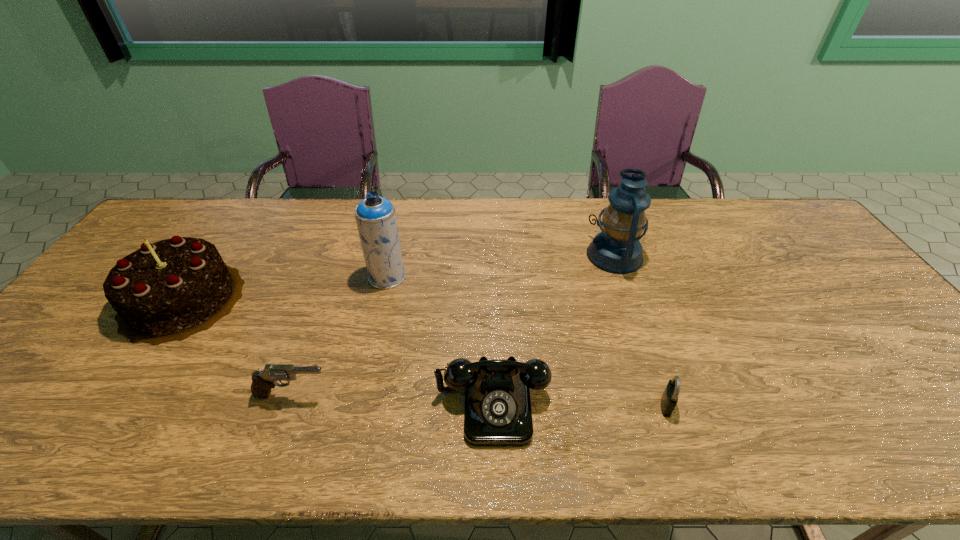
This screenshot has width=960, height=540. I want to click on vacant space at the right edge of the desktop, so click(932, 383).

In the image, there is a desktop. Where is `free region at the far right corner`? free region at the far right corner is located at coordinates (809, 236).

The height and width of the screenshot is (540, 960). I want to click on free space between the fifth object from right to left and the fourth shortest object, so click(x=237, y=347).

Locate an element on the screen. vacant area between the telephone and the lantern is located at coordinates (554, 329).

Locate an element on the screen. The image size is (960, 540). vacant space in between the shortest object and the telephone is located at coordinates (580, 404).

Where is `free spot between the third tallest object and the telephone`? The width and height of the screenshot is (960, 540). free spot between the third tallest object and the telephone is located at coordinates (338, 351).

The width and height of the screenshot is (960, 540). I want to click on blank region between the padlock and the fourth object from left to right, so click(x=580, y=404).

The image size is (960, 540). I want to click on empty space between the third object from right to left and the pistol, so click(393, 399).

Locate an element on the screen. Image resolution: width=960 pixels, height=540 pixels. unoccupied area between the pistol and the fourth shortest object is located at coordinates (237, 347).

Identify the location of vacant space that's between the birthday cake and the aerosol can. Image resolution: width=960 pixels, height=540 pixels. (285, 288).